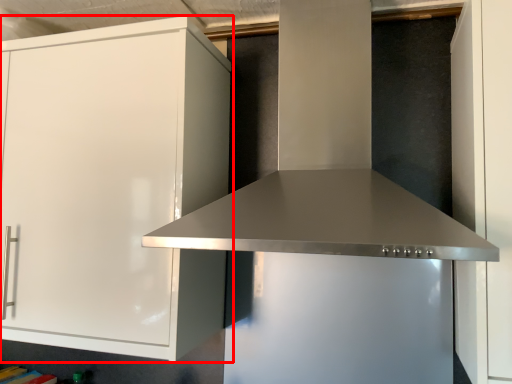
Question: Considering the relative positions of cabinetry (annotated by the red box) and vent in the image provided, where is cabinetry (annotated by the red box) located with respect to the staircase?

Choices:
 (A) right
 (B) left

Answer: (B)